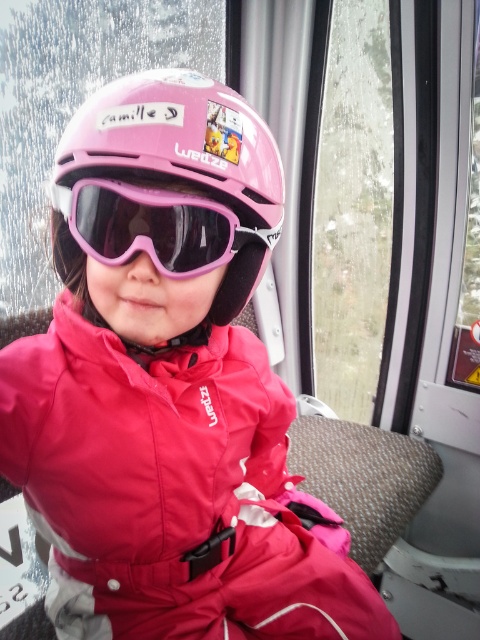
How much distance is there between pink matte helmet at center and pink matte/glossy goggles at center?

pink matte helmet at center and pink matte/glossy goggles at center are 2.91 centimeters apart from each other.

Does pink matte helmet at center lie in front of pink matte/glossy goggles at center?

Yes, it is.

Where is `pink matte helmet at center`? This screenshot has height=640, width=480. pink matte helmet at center is located at coordinates (168, 184).